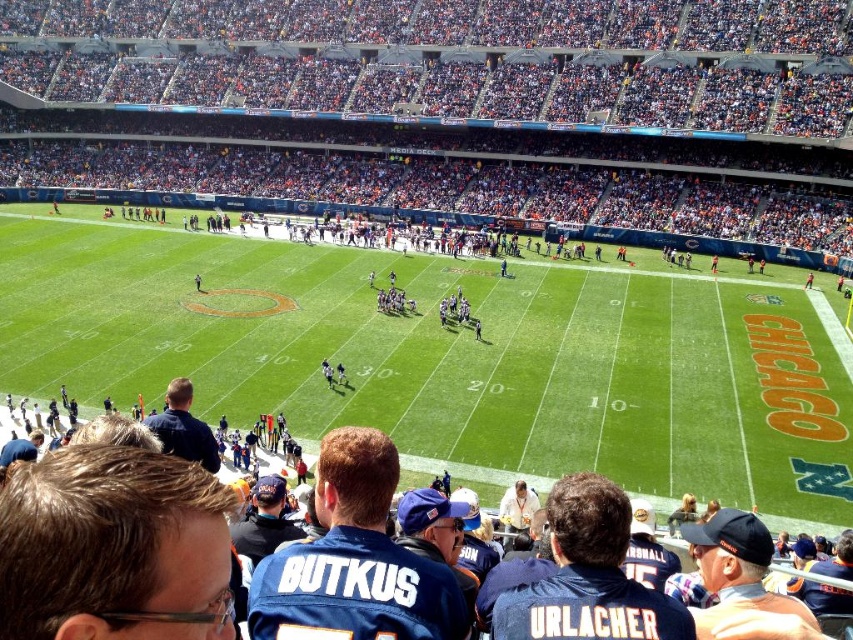
Question: Can you confirm if green grass football field at center is wider than blue jersey at center?

Choices:
 (A) yes
 (B) no

Answer: (A)

Question: Considering the relative positions of orange fabric seats at upper center and green grass football field at center in the image provided, where is orange fabric seats at upper center located with respect to green grass football field at center?

Choices:
 (A) below
 (B) above

Answer: (B)

Question: Is green grass football field at center below blue jersey at center?

Choices:
 (A) no
 (B) yes

Answer: (A)

Question: Based on their relative distances, which object is farther from the blue jersey at center?

Choices:
 (A) orange fabric seats at upper center
 (B) green grass football field at center

Answer: (A)

Question: Among these points, which one is farthest from the camera?

Choices:
 (A) (693, 230)
 (B) (287, 349)

Answer: (A)

Question: Which object appears farthest from the camera in this image?

Choices:
 (A) orange fabric seats at upper center
 (B) blue jersey at center

Answer: (A)